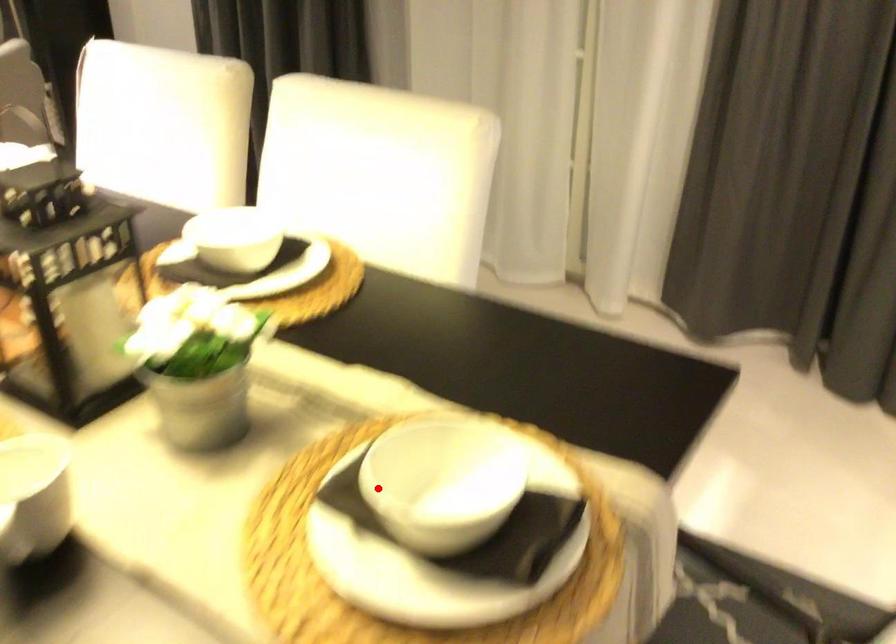
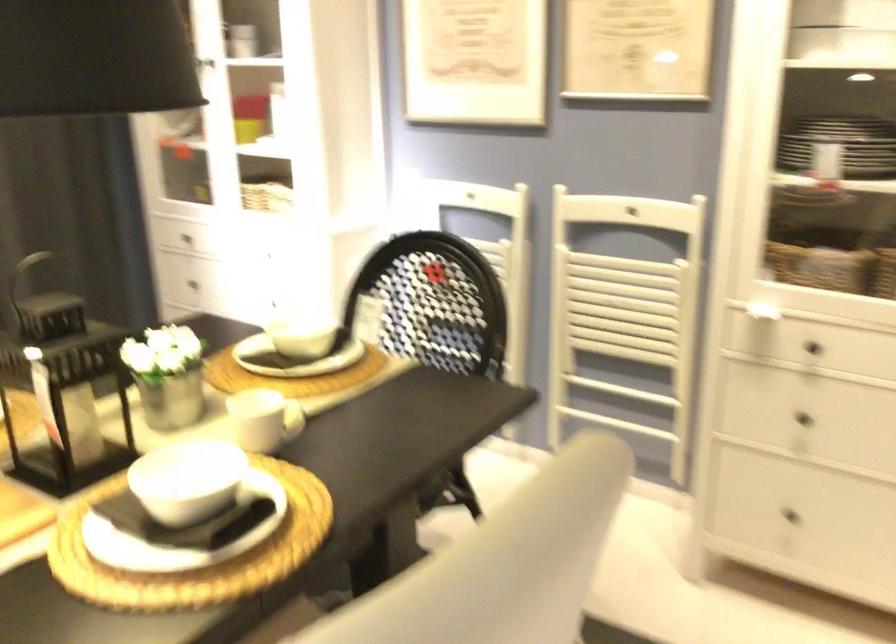
Locate, in the second image, the point that corresponds to the highlighted location in the first image.

(306, 337)